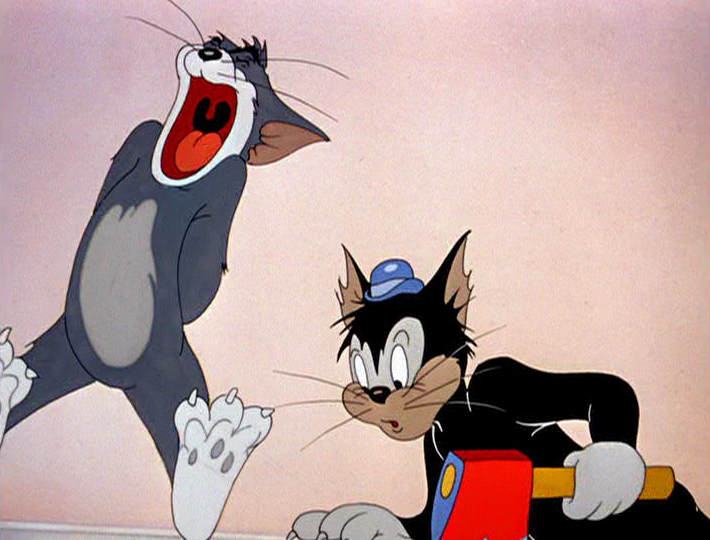
Where is `wall`? The width and height of the screenshot is (710, 540). wall is located at coordinates (596, 236).